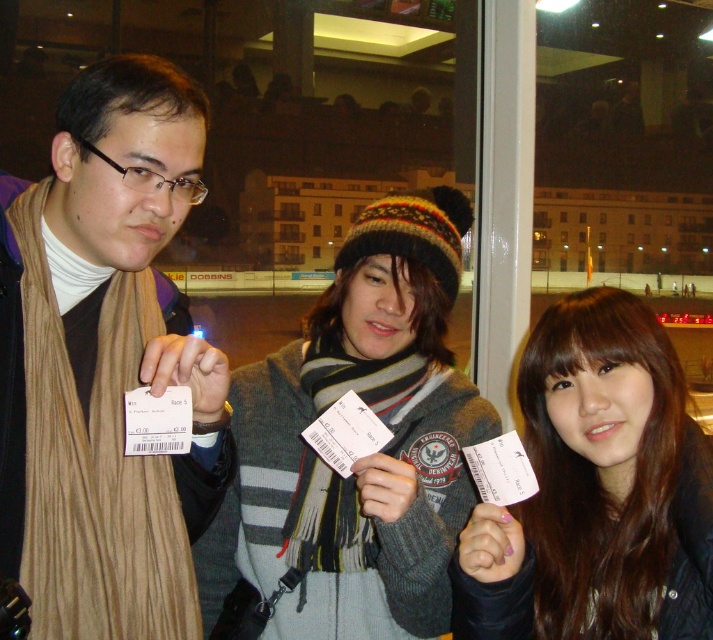
Question: Can you confirm if brown wool scarf at left is positioned to the left of brown matte hair at center?

Choices:
 (A) no
 (B) yes

Answer: (B)

Question: Which object is the closest to the brown matte hair at center?

Choices:
 (A) brown wool scarf at left
 (B) gray knit sweater at center

Answer: (B)

Question: Which point is farther to the camera?

Choices:
 (A) gray knit sweater at center
 (B) brown matte hair at center
 (C) brown wool scarf at left

Answer: (A)

Question: Is brown wool scarf at left below brown matte hair at center?

Choices:
 (A) no
 (B) yes

Answer: (A)

Question: Considering the real-world distances, which object is farthest from the brown matte hair at center?

Choices:
 (A) brown wool scarf at left
 (B) gray knit sweater at center

Answer: (A)

Question: Can you confirm if brown wool scarf at left is positioned below brown matte hair at center?

Choices:
 (A) yes
 (B) no

Answer: (B)